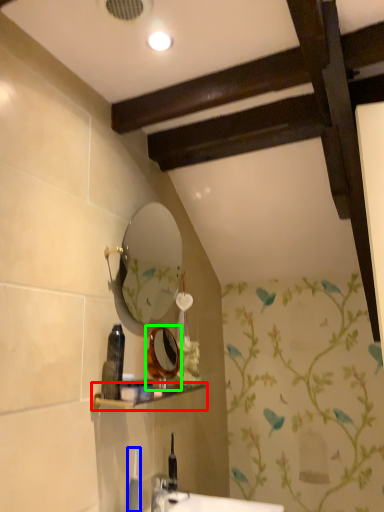
Question: Considering the real-world distances, which object is farthest from shelf (highlighted by a red box)? toiletry (highlighted by a blue box) or mirror (highlighted by a green box)?

Choices:
 (A) toiletry
 (B) mirror

Answer: (A)